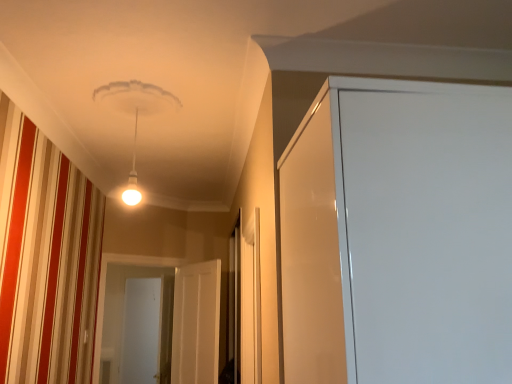
The image size is (512, 384). Describe the element at coordinates (105, 287) in the screenshot. I see `white glossy door at center, placed as the 2th screen door when sorted from back to front` at that location.

Locate an element on the screen. The width and height of the screenshot is (512, 384). white glossy screen door at center, which is counted as the first screen door, starting from the left is located at coordinates (141, 331).

Who is bigger, white glossy screen door at center, which appears as the third screen door when viewed from the right, or white glossy door at center, which ranks as the 1th screen door in front-to-back order?

white glossy screen door at center, which appears as the third screen door when viewed from the right, is bigger.

From a real-world perspective, which object stands above the other?

From a 3D spatial view, white glossy door at center, arranged as the 3th screen door when viewed from the back, is above.

Which is more distant, (x=152, y=300) or (x=211, y=321)?

The point (x=152, y=300) is more distant.

Based on the photo, is white glossy screen door at center, which appears as the 1th screen door when viewed from the back, positioned in front of white glossy door at center, arranged as the 3th screen door when viewed from the left?

No, it is behind white glossy door at center, arranged as the 3th screen door when viewed from the left.

Is white glossy door at center, the 2th screen door in the right-to-left sequence, oriented towards white glossy screen door at center, arranged as the third screen door when viewed from the front?

No, white glossy door at center, the 2th screen door in the right-to-left sequence, is not turned towards white glossy screen door at center, arranged as the third screen door when viewed from the front.

Which of these two, white glossy door at center, placed as the 2th screen door when sorted from back to front, or white glossy screen door at center, which is counted as the first screen door, starting from the left, is wider?

white glossy door at center, placed as the 2th screen door when sorted from back to front, is wider.

You are a GUI agent. You are given a task and a screenshot of the screen. Output one action in this format:
    pyautogui.click(x=<x>, y=<y>)
    Task: Click on the screen door behind the white glossy door at center, which is the 2th screen door in front-to-back order
    Image resolution: width=512 pixels, height=384 pixels.
    Given the screenshot: What is the action you would take?
    pyautogui.click(x=141, y=331)

Is white glossy door at center, arranged as the 3th screen door when viewed from the back, wider than white glossy screen door at center, arranged as the third screen door when viewed from the front?

Incorrect, the width of white glossy door at center, arranged as the 3th screen door when viewed from the back, does not surpass that of white glossy screen door at center, arranged as the third screen door when viewed from the front.

Which screen door is the 2nd one when counting from the back of the white glossy door at center, arranged as the 3th screen door when viewed from the left? Please provide its 2D coordinates.

[(141, 331)]

Is point (178, 268) less distant than point (123, 369)?

Yes, point (178, 268) is closer to viewer.

From a real-world perspective, which object rests below the other?

white glossy screen door at center, arranged as the third screen door when viewed from the front, is physically lower.

Which is in front, point (198, 363) or point (101, 268)?

The point (198, 363) is closer.

From a real-world perspective, who is located higher, white glossy door at center, arranged as the 3th screen door when viewed from the left, or white glossy door at center, acting as the second screen door starting from the left?

From a 3D spatial view, white glossy door at center, acting as the second screen door starting from the left, is above.

Based on their sizes in the image, would you say white glossy door at center, which is the 1th screen door from right to left, is bigger or smaller than white glossy door at center, placed as the 2th screen door when sorted from back to front?

Clearly, white glossy door at center, which is the 1th screen door from right to left, is smaller in size than white glossy door at center, placed as the 2th screen door when sorted from back to front.

This screenshot has width=512, height=384. In order to click on screen door above the white glossy door at center, which is the 1th screen door from right to left (from a real-world perspective) in this screenshot , I will do point(105,287).

Is white glossy screen door at center, arranged as the third screen door when viewed from the front, turned away from white glossy door at center, acting as the second screen door starting from the left?

white glossy screen door at center, arranged as the third screen door when viewed from the front, does not have its back to white glossy door at center, acting as the second screen door starting from the left.

Considering their positions, is white glossy screen door at center, which is counted as the first screen door, starting from the left, located in front of or behind white glossy door at center, which is the 2th screen door in front-to-back order?

In the image, white glossy screen door at center, which is counted as the first screen door, starting from the left, appears behind white glossy door at center, which is the 2th screen door in front-to-back order.

At what (x,y) coordinates should I click in order to perform the action: click on the 2nd screen door positioned below the white glossy door at center, acting as the second screen door starting from the left (from a real-world perspective). Please return your answer as a coordinate pair (x, y). The width and height of the screenshot is (512, 384). Looking at the image, I should click on (141, 331).

From the picture: Considering the relative sizes of white glossy screen door at center, which appears as the third screen door when viewed from the right, and white glossy door at center, acting as the second screen door starting from the left, in the image provided, is white glossy screen door at center, which appears as the third screen door when viewed from the right, shorter than white glossy door at center, acting as the second screen door starting from the left,?

Incorrect, the height of white glossy screen door at center, which appears as the third screen door when viewed from the right, does not fall short of that of white glossy door at center, acting as the second screen door starting from the left.

In the image, is white glossy door at center, the 2th screen door in the right-to-left sequence, positioned in front of or behind white glossy door at center, arranged as the 3th screen door when viewed from the left?

white glossy door at center, the 2th screen door in the right-to-left sequence, is positioned farther from the viewer than white glossy door at center, arranged as the 3th screen door when viewed from the left.

Does point (153, 265) appear closer or farther from the camera than point (209, 269)?

Point (153, 265) is positioned farther from the camera compared to point (209, 269).

Can you confirm if white glossy door at center, acting as the second screen door starting from the left, is positioned to the right of white glossy door at center, which ranks as the 1th screen door in front-to-back order?

No.

Could white glossy door at center, arranged as the 3th screen door when viewed from the left, be considered to be inside white glossy door at center, acting as the second screen door starting from the left?

No.

Locate an element on the screen. This screenshot has width=512, height=384. screen door that is the 2nd one when counting backward from the white glossy door at center, which is the 1th screen door from right to left is located at coordinates (141, 331).

This screenshot has width=512, height=384. I want to click on the 1st screen door counting from the right side of the white glossy screen door at center, which is counted as the first screen door, starting from the left, so click(x=105, y=287).

When comparing their distances from white glossy door at center, acting as the second screen door starting from the left, does white glossy screen door at center, which appears as the third screen door when viewed from the right, or white glossy door at center, which is the 1th screen door from right to left, seem further?

Among the two, white glossy screen door at center, which appears as the third screen door when viewed from the right, is located further to white glossy door at center, acting as the second screen door starting from the left.

When comparing their distances from white glossy door at center, which is the 1th screen door from right to left, does white glossy screen door at center, which appears as the 1th screen door when viewed from the back, or white glossy door at center, the 2th screen door in the right-to-left sequence, seem closer?

white glossy door at center, the 2th screen door in the right-to-left sequence.

Considering their positions, is white glossy door at center, arranged as the 3th screen door when viewed from the left, positioned closer to white glossy screen door at center, which is counted as the first screen door, starting from the left, than white glossy door at center, placed as the 2th screen door when sorted from back to front?

white glossy door at center, placed as the 2th screen door when sorted from back to front, is positioned closer to the anchor white glossy screen door at center, which is counted as the first screen door, starting from the left.

Looking at this image, when comparing their distances from white glossy door at center, acting as the second screen door starting from the left, does white glossy door at center, arranged as the 3th screen door when viewed from the back, or white glossy screen door at center, which appears as the 1th screen door when viewed from the back, seem further?

Among the two, white glossy screen door at center, which appears as the 1th screen door when viewed from the back, is located further to white glossy door at center, acting as the second screen door starting from the left.

From the image, which object appears to be nearer to white glossy door at center, which is the 1th screen door from right to left, white glossy door at center, placed as the 2th screen door when sorted from back to front, or white glossy screen door at center, which appears as the 1th screen door when viewed from the back?

white glossy door at center, placed as the 2th screen door when sorted from back to front, is closer to white glossy door at center, which is the 1th screen door from right to left.

From the image, which object appears to be farther from white glossy screen door at center, arranged as the third screen door when viewed from the front, white glossy door at center, which is the 2th screen door in front-to-back order, or white glossy door at center, arranged as the 3th screen door when viewed from the left?

Based on the image, white glossy door at center, arranged as the 3th screen door when viewed from the left, appears to be further to white glossy screen door at center, arranged as the third screen door when viewed from the front.

Locate an element on the screen. The height and width of the screenshot is (384, 512). screen door positioned between white glossy door at center, arranged as the 3th screen door when viewed from the back, and white glossy screen door at center, which appears as the 1th screen door when viewed from the back, from near to far is located at coordinates (105, 287).